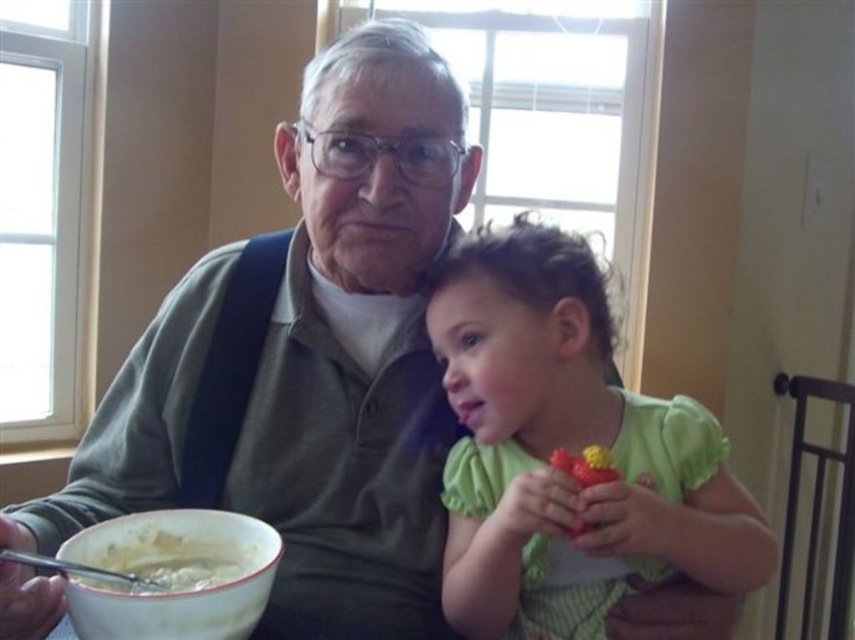
Question: Is matte green shirt at center to the left of green fabric toy at right from the viewer's perspective?

Choices:
 (A) yes
 (B) no

Answer: (A)

Question: Which object is positioned farthest from the white glossy bowl at lower left?

Choices:
 (A) white creamy soup at lower left
 (B) matte green shirt at center

Answer: (B)

Question: Which point is farther from the camera taking this photo?

Choices:
 (A) (402, 333)
 (B) (205, 529)
 (C) (582, 579)

Answer: (A)

Question: Considering the relative positions of green fabric toy at right and white glossy bowl at lower left in the image provided, where is green fabric toy at right located with respect to white glossy bowl at lower left?

Choices:
 (A) below
 (B) above

Answer: (B)

Question: Can you confirm if green fabric toy at right is bigger than white creamy soup at lower left?

Choices:
 (A) no
 (B) yes

Answer: (B)

Question: Which point is closer to the camera taking this photo?

Choices:
 (A) (375, 596)
 (B) (463, 298)
 (C) (124, 563)
 (D) (86, 582)

Answer: (D)